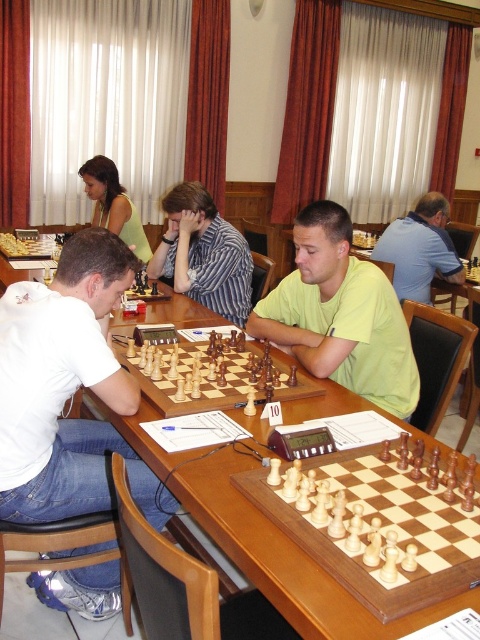
Question: Can you confirm if light green shirt at center is smaller than light wood chessboard at center?

Choices:
 (A) yes
 (B) no

Answer: (B)

Question: Which of the following is the farthest from the observer?

Choices:
 (A) light wood chessboard at center
 (B) light green shirt at center

Answer: (B)

Question: Is light wood chessboard at center to the left of striped shirt at center from the viewer's perspective?

Choices:
 (A) no
 (B) yes

Answer: (A)

Question: Can you confirm if white t-shirt at left is positioned to the right of light green shirt at center?

Choices:
 (A) yes
 (B) no

Answer: (B)

Question: Which of the following is the closest to the observer?

Choices:
 (A) (402, 483)
 (B) (48, 440)
 (C) (120, 221)

Answer: (A)

Question: Which object is farther from the camera taking this photo?

Choices:
 (A) light brown wooden chessboard at center
 (B) light green shirt at center
 (C) blue striped shirt at upper right

Answer: (C)